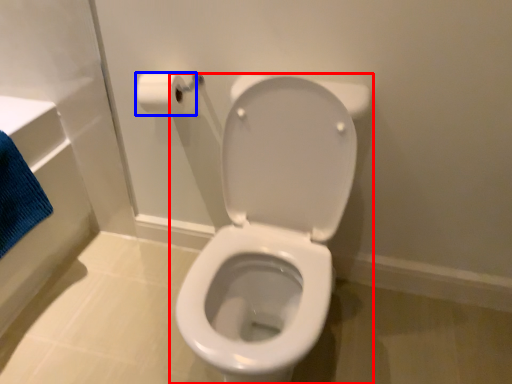
Question: Which point is further to the camera, toilet (highlighted by a red box) or toilet paper (highlighted by a blue box)?

Choices:
 (A) toilet
 (B) toilet paper

Answer: (B)